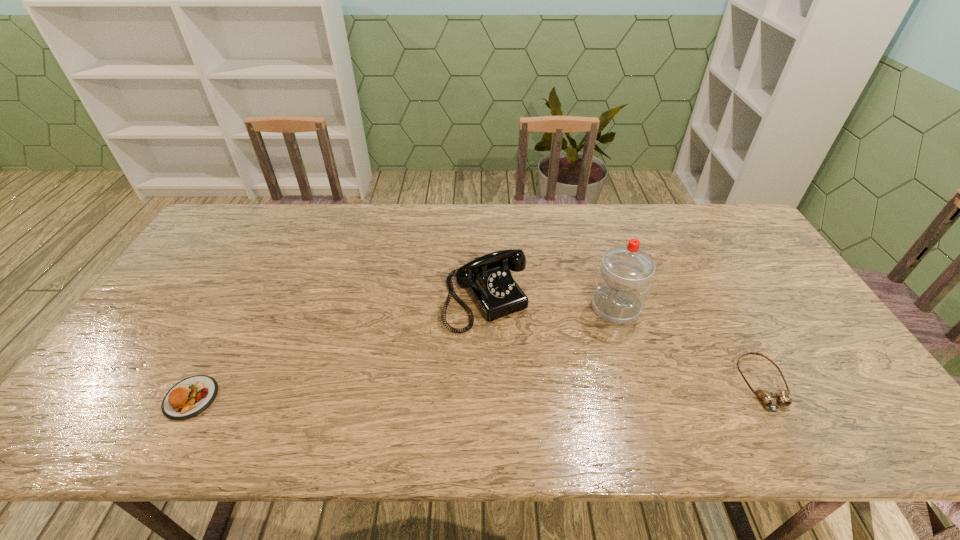
The height and width of the screenshot is (540, 960). What are the coordinates of `vacant space at the right edge of the desktop` in the screenshot? It's located at (787, 289).

At what (x,y) coordinates should I click in order to perform the action: click on vacant position at the far right corner of the desktop. Please return your answer as a coordinate pair (x, y). Looking at the image, I should click on (708, 218).

Where is `vacant region between the second shortest object and the goggles`? The image size is (960, 540). vacant region between the second shortest object and the goggles is located at coordinates (477, 391).

You are a GUI agent. You are given a task and a screenshot of the screen. Output one action in this format:
    pyautogui.click(x=<x>, y=<y>)
    Task: Click on the vacant space in between the second object from left to right and the rightmost object
    The width and height of the screenshot is (960, 540).
    Given the screenshot: What is the action you would take?
    click(624, 342)

Identify the location of free area in between the water bottle and the third object from right to left. (550, 303).

You are a GUI agent. You are given a task and a screenshot of the screen. Output one action in this format:
    pyautogui.click(x=<x>, y=<y>)
    Task: Click on the empty location between the water bottle and the patty (food)
    The image size is (960, 540).
    Given the screenshot: What is the action you would take?
    pyautogui.click(x=403, y=353)

This screenshot has width=960, height=540. I want to click on unoccupied area between the water bottle and the patty (food), so click(403, 353).

You are a GUI agent. You are given a task and a screenshot of the screen. Output one action in this format:
    pyautogui.click(x=<x>, y=<y>)
    Task: Click on the free space between the tallest object and the second tallest object
    Image resolution: width=960 pixels, height=540 pixels.
    Given the screenshot: What is the action you would take?
    pyautogui.click(x=550, y=303)

This screenshot has height=540, width=960. Find the location of `vacant space that is in between the shortest object and the tallest object`. vacant space that is in between the shortest object and the tallest object is located at coordinates (689, 346).

Where is `free area in between the tallest object and the patty (food)`? free area in between the tallest object and the patty (food) is located at coordinates (403, 353).